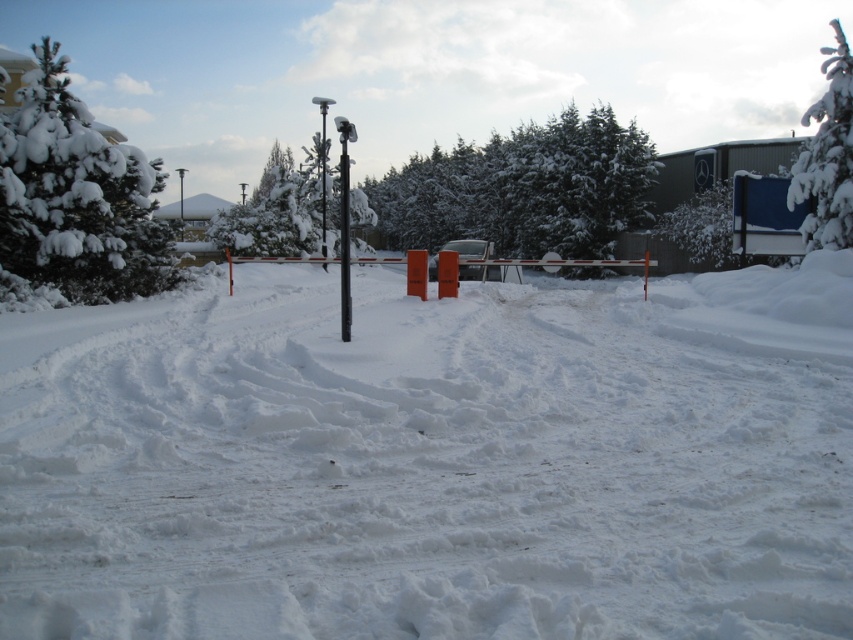
Can you confirm if snow-covered evergreen at center is taller than metallic pole at center?

Yes, snow-covered evergreen at center is taller than metallic pole at center.

Can you confirm if snow-covered evergreen at center is thinner than metallic pole at center?

In fact, snow-covered evergreen at center might be wider than metallic pole at center.

Image resolution: width=853 pixels, height=640 pixels. What are the coordinates of `snow-covered evergreen at center` in the screenshot? It's located at (524, 188).

Is white fluffy tree at upper left further to the viewer compared to metallic pole at center?

Yes, it is.

Can you confirm if white fluffy tree at upper left is taller than metallic pole at center?

Yes.

Where is `white fluffy tree at upper left`? white fluffy tree at upper left is located at coordinates (77, 196).

This screenshot has width=853, height=640. Find the location of `white fluffy tree at upper left`. white fluffy tree at upper left is located at coordinates (77, 196).

Between white snow-covered tree at upper right and metallic pole at center, which one is positioned lower?

Positioned lower is metallic pole at center.

This screenshot has width=853, height=640. In order to click on white snow-covered tree at upper right in this screenshot , I will do `click(827, 156)`.